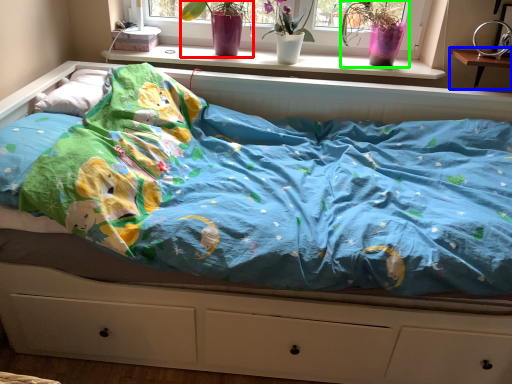
Question: Which is farther away from floral arrangement (highlighted by a red box)? changing table (highlighted by a blue box) or floral arrangement (highlighted by a green box)?

Choices:
 (A) changing table
 (B) floral arrangement

Answer: (A)